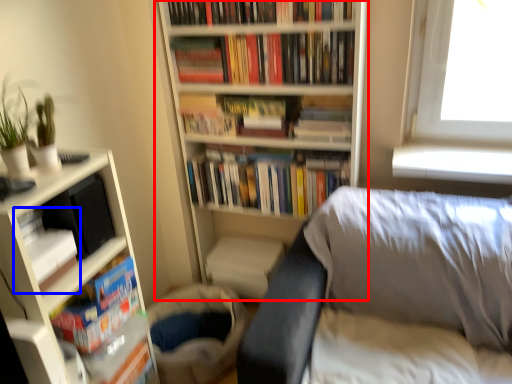
Question: Which of the following is the closest to the observer, bookcase (highlighted by a red box) or book (highlighted by a blue box)?

Choices:
 (A) bookcase
 (B) book

Answer: (B)